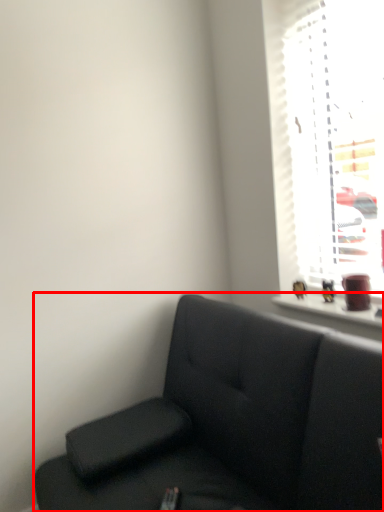
Question: From the image's perspective, what is the correct spatial relationship of studio couch (annotated by the red box) in relation to window?

Choices:
 (A) below
 (B) above

Answer: (A)